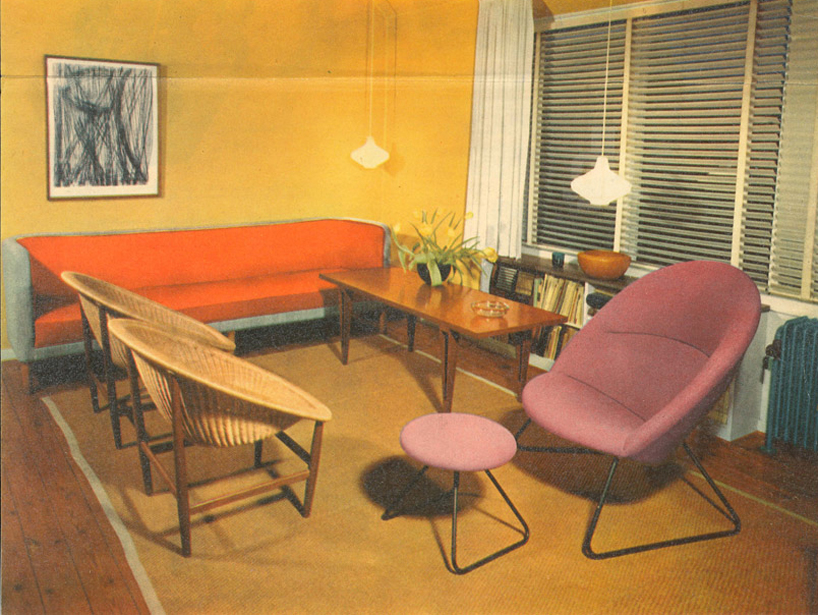
Locate an element on the screen. This screenshot has height=615, width=818. couch is located at coordinates (182, 259).